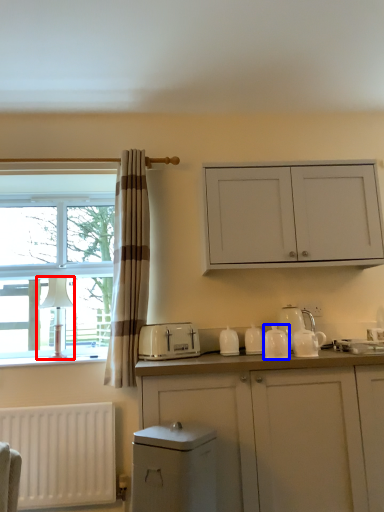
Question: Among these objects, which one is nearest to the camera, lamp (highlighted by a red box) or tableware (highlighted by a blue box)?

Choices:
 (A) lamp
 (B) tableware

Answer: (B)